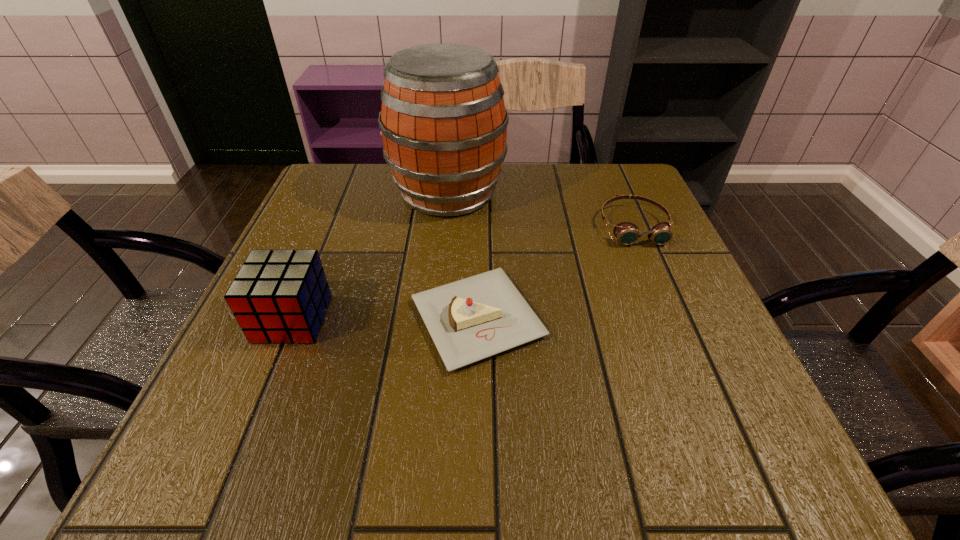
I want to click on goggles at the far edge, so click(627, 233).

You are a GUI agent. You are given a task and a screenshot of the screen. Output one action in this format:
    pyautogui.click(x=<x>, y=<y>)
    Task: Click on the object present at the left edge
    
    Given the screenshot: What is the action you would take?
    pyautogui.click(x=278, y=296)

You are a GUI agent. You are given a task and a screenshot of the screen. Output one action in this format:
    pyautogui.click(x=<x>, y=<y>)
    Task: Click on the object located at the right edge
    The width and height of the screenshot is (960, 540).
    Given the screenshot: What is the action you would take?
    pyautogui.click(x=627, y=233)

At what (x,y) coordinates should I click in order to perform the action: click on object that is at the far right corner. Please return your answer as a coordinate pair (x, y). This screenshot has width=960, height=540. Looking at the image, I should click on (627, 233).

Identify the location of free space at the far edge of the desktop. Image resolution: width=960 pixels, height=540 pixels. 516,167.

In order to click on free space at the near edge of the desktop in this screenshot , I will do click(530, 461).

Where is `blank space at the right edge`? The height and width of the screenshot is (540, 960). blank space at the right edge is located at coordinates (672, 276).

Find the location of a particular element. This screenshot has height=540, width=960. vacant area at the near left corner is located at coordinates (271, 445).

Find the location of a particular element. vacant region at the far right corner of the desktop is located at coordinates (597, 188).

Where is `vacant space at the near right corner`? This screenshot has width=960, height=540. vacant space at the near right corner is located at coordinates (760, 426).